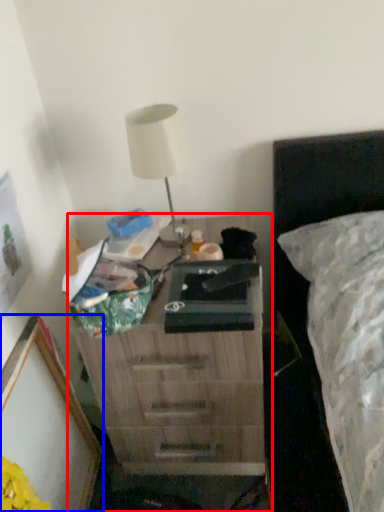
Question: Which point is further to the camera, nightstand (highlighted by a red box) or picture frame (highlighted by a blue box)?

Choices:
 (A) nightstand
 (B) picture frame

Answer: (A)